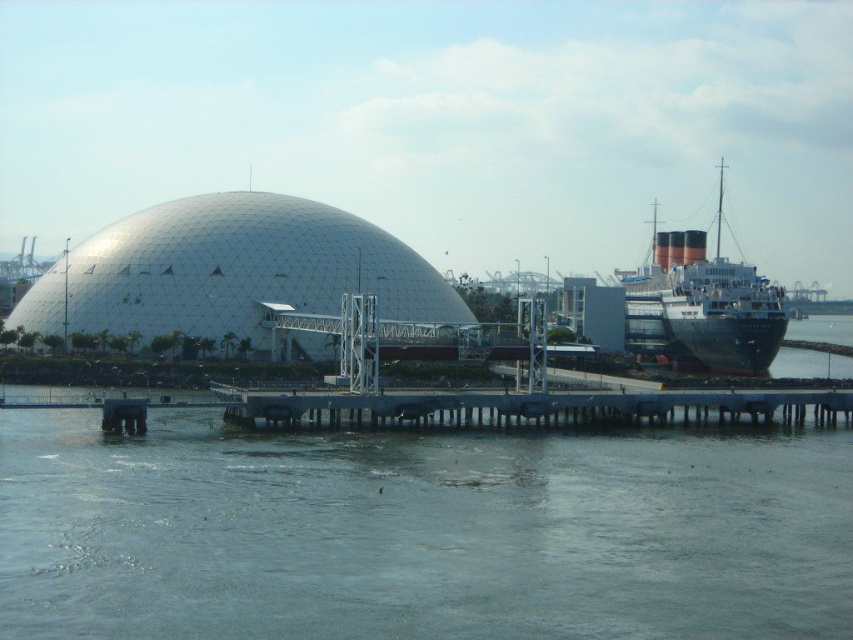
Question: Observing the image, what is the correct spatial positioning of clear water at lower center in reference to black polished ship at right?

Choices:
 (A) above
 (B) below

Answer: (B)

Question: Which point is farther from the camera taking this photo?

Choices:
 (A) (734, 268)
 (B) (227, 410)
 (C) (180, 250)

Answer: (A)

Question: Is clear water at lower center in front of blue metallic dock at center?

Choices:
 (A) no
 (B) yes

Answer: (B)

Question: Which of the following is the closest to the observer?

Choices:
 (A) white geodesic dome at center
 (B) clear water at lower center
 (C) black polished ship at right

Answer: (B)

Question: Which of the following is the farthest from the observer?

Choices:
 (A) clear water at lower center
 (B) black polished ship at right

Answer: (B)

Question: Can you confirm if blue metallic dock at center is thinner than black polished ship at right?

Choices:
 (A) yes
 (B) no

Answer: (B)